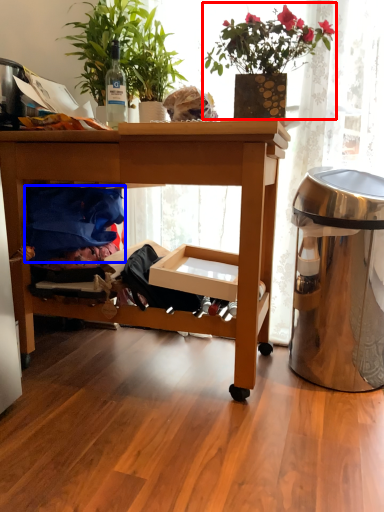
Question: Which object appears closest to the camera in this image, houseplant (highlighted by a red box) or clothing (highlighted by a blue box)?

Choices:
 (A) houseplant
 (B) clothing

Answer: (A)